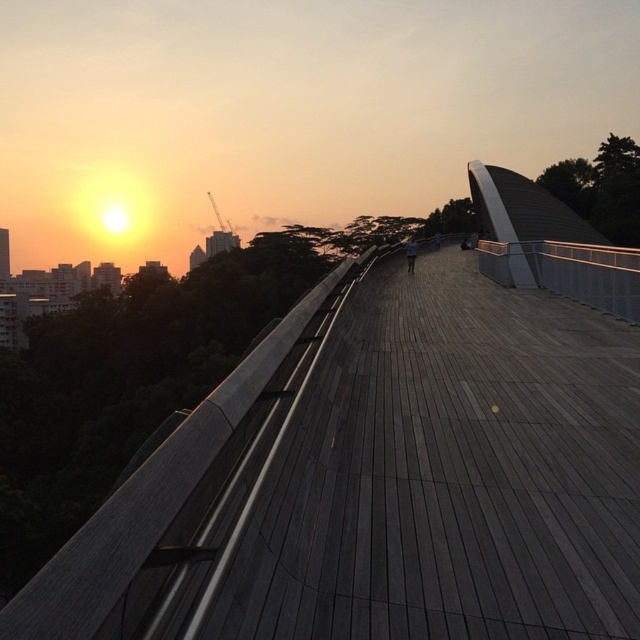
Between dark gray fabric at center and dark blue jeans at center, which one appears on the right side from the viewer's perspective?

From the viewer's perspective, dark blue jeans at center appears more on the right side.

Who is higher up, dark gray fabric at center or dark blue jeans at center?

Positioned higher is dark blue jeans at center.

The image size is (640, 640). Identify the location of dark gray fabric at center. (410, 253).